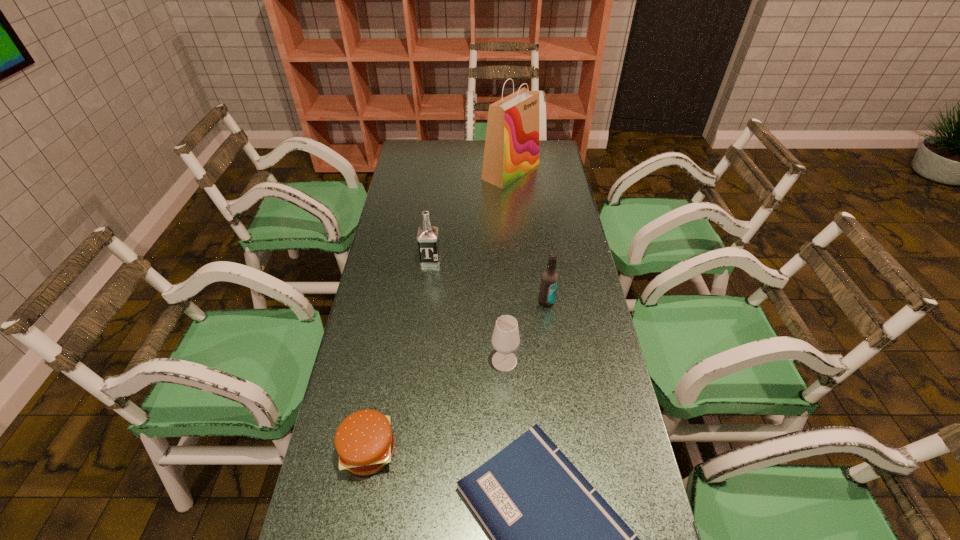
Find the location of a particular element. The height and width of the screenshot is (540, 960). the tallest object is located at coordinates (511, 149).

Image resolution: width=960 pixels, height=540 pixels. I want to click on shopping bag, so click(x=511, y=149).

Where is `the fifth nearest object`? The height and width of the screenshot is (540, 960). the fifth nearest object is located at coordinates (428, 241).

Locate an element on the screen. This screenshot has width=960, height=540. the third farthest object is located at coordinates coord(549,281).

Locate an element on the screen. Image resolution: width=960 pixels, height=540 pixels. the third shortest object is located at coordinates (505, 339).

I want to click on glass, so [505, 339].

This screenshot has width=960, height=540. I want to click on the fifth tallest object, so click(364, 440).

Find the location of a particular element. vacant space located on the back of the farthest object is located at coordinates (509, 146).

Locate an element on the screen. Image resolution: width=960 pixels, height=540 pixels. free space located on the front label of the vodka is located at coordinates (423, 319).

Find the location of a particular element. free region located on the side of the third farthest object with the label is located at coordinates (552, 339).